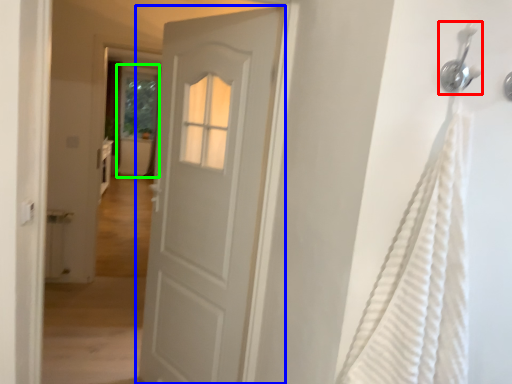
Question: Estimate the real-world distances between objects in this image. Which object is closer to shower (highlighted by a red box), door (highlighted by a blue box) or screen door (highlighted by a green box)?

Choices:
 (A) door
 (B) screen door

Answer: (A)